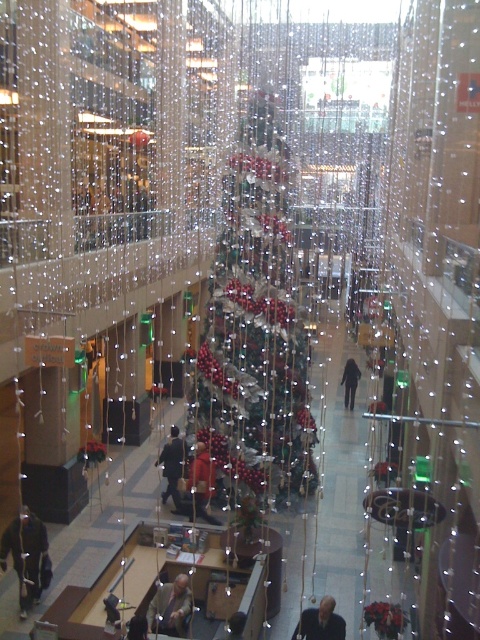
Is point (339, 616) positioned before point (356, 374)?

Yes, it is.

Does point (300, 624) come farther from viewer compared to point (355, 371)?

No, (300, 624) is closer to viewer.

Who is more distant from viewer, (336, 625) or (359, 371)?

The point (359, 371) is behind.

You are a GUI agent. You are given a task and a screenshot of the screen. Output one action in this format:
    pyautogui.click(x=<x>, y=<y>)
    Task: Click on the dark suit at lower center
    
    Given the screenshot: What is the action you would take?
    pyautogui.click(x=321, y=621)

From the picture: Does dark blue jacket at lower left have a larger size compared to dark gray coat at center?

No, dark blue jacket at lower left is not bigger than dark gray coat at center.

Can you confirm if dark blue jacket at lower left is taller than dark gray coat at center?

Correct, dark blue jacket at lower left is much taller as dark gray coat at center.

Locate an element on the screen. dark blue jacket at lower left is located at coordinates (26, 556).

Does light brown leather jacket at center have a greater width compared to dark gray coat at center?

Incorrect, light brown leather jacket at center's width does not surpass dark gray coat at center's.

Who is positioned more to the left, light brown leather jacket at center or dark gray coat at center?

Positioned to the left is dark gray coat at center.

Image resolution: width=480 pixels, height=640 pixels. I want to click on light brown leather jacket at center, so click(169, 608).